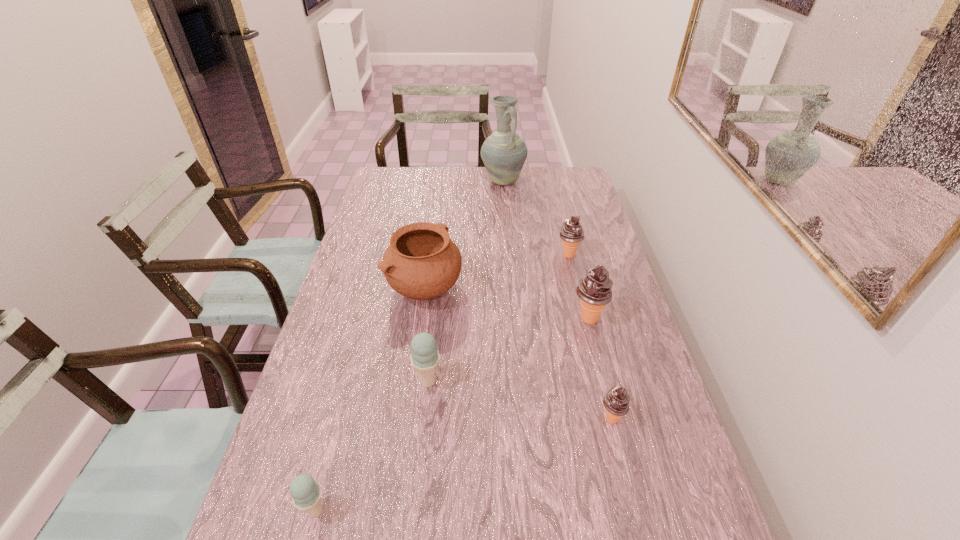
Image resolution: width=960 pixels, height=540 pixels. Identify the location of object at the far edge. (504, 152).

Image resolution: width=960 pixels, height=540 pixels. I want to click on pottery situated at the left edge, so click(x=422, y=262).

Find the location of a particular element. ice cream located in the left edge section of the desktop is located at coordinates (306, 493).

Where is `vacant area at the far edge of the desktop`? vacant area at the far edge of the desktop is located at coordinates (541, 179).

This screenshot has width=960, height=540. Identify the location of blank space at the left edge of the desktop. (390, 217).

The image size is (960, 540). What are the coordinates of `vacant space at the right edge of the desktop` in the screenshot? It's located at (553, 206).

Identify the location of free point at the far right corner. This screenshot has width=960, height=540. (561, 179).

Where is `free space that is in between the nearest chocolate icecream and the right blue ice cream`? Image resolution: width=960 pixels, height=540 pixels. free space that is in between the nearest chocolate icecream and the right blue ice cream is located at coordinates (519, 400).

This screenshot has width=960, height=540. Find the location of `vacant area that lies between the tallest ice cream and the leftmost ice cream`. vacant area that lies between the tallest ice cream and the leftmost ice cream is located at coordinates (452, 415).

Where is `vacant point located between the nearest ice cream and the nearest chocolate icecream`? vacant point located between the nearest ice cream and the nearest chocolate icecream is located at coordinates point(464,465).